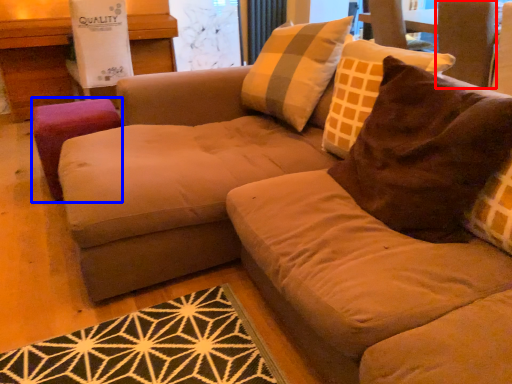
Question: Which point is closer to the camera, swivel chair (highlighted by a red box) or stool (highlighted by a blue box)?

Choices:
 (A) swivel chair
 (B) stool

Answer: (B)